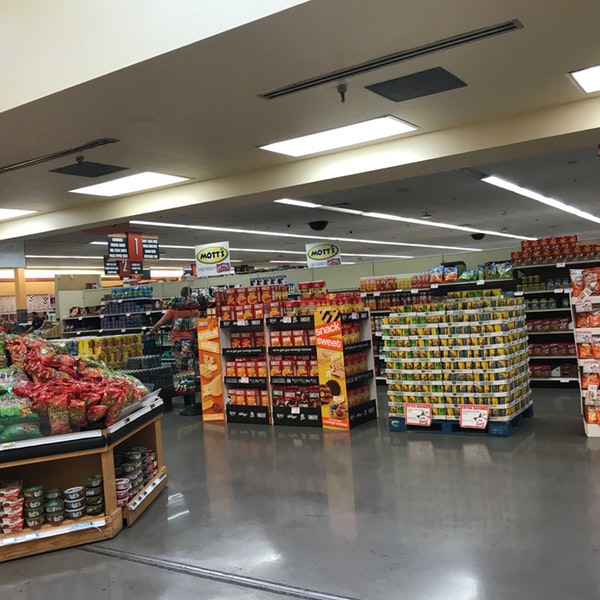
Identify the location of lights. (145, 177), (321, 144), (588, 78), (8, 217).